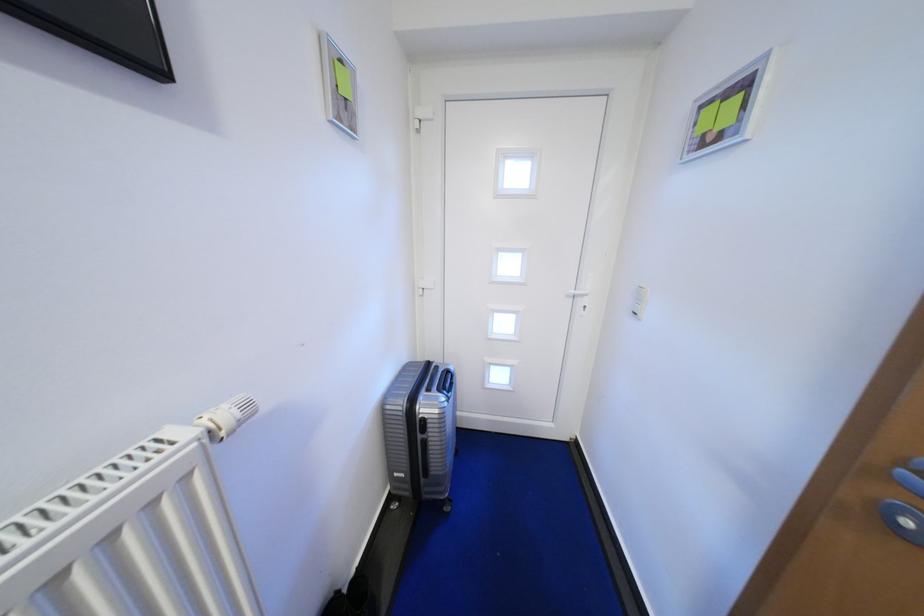
Image resolution: width=924 pixels, height=616 pixels. What do you see at coordinates (445, 382) in the screenshot?
I see `the black suitcase handle` at bounding box center [445, 382].